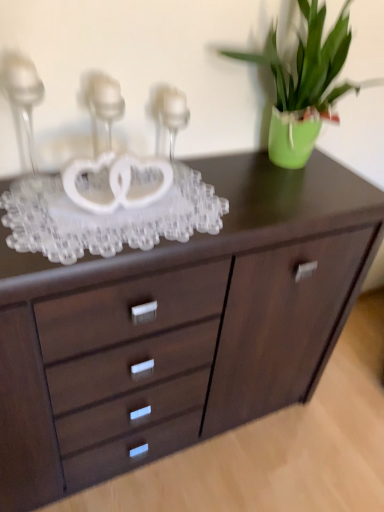
Identify the location of clear glass candle holder at upper left, the 2th candle holder positioned from the left. The width and height of the screenshot is (384, 512). (103, 109).

Locate an element on the screen. Image resolution: width=384 pixels, height=512 pixels. clear glass candle holder at upper left, positioned as the third candle holder in right-to-left order is located at coordinates (22, 102).

What do you see at coordinates (173, 114) in the screenshot? The image size is (384, 512). I see `clear glass candle holder at center, placed as the first candle holder when sorted from right to left` at bounding box center [173, 114].

Locate an element on the screen. clear glass candle holder at center, placed as the 3th candle holder when sorted from left to right is located at coordinates (173, 114).

Locate an element on the screen. clear glass candle holder at upper left, acting as the 2th candle holder starting from the right is located at coordinates (103, 109).

From the picture: Between clear glass candle holder at upper left, acting as the 2th candle holder starting from the right, and green matte vase at upper right, which one has less height?

Standing shorter between the two is clear glass candle holder at upper left, acting as the 2th candle holder starting from the right.

Who is smaller, clear glass candle holder at upper left, the 2th candle holder positioned from the left, or green matte vase at upper right?

With smaller size is clear glass candle holder at upper left, the 2th candle holder positioned from the left.

Between point (120, 95) and point (290, 7), which one is positioned in front?

The point (120, 95) is closer to the camera.

Where is `houseplant on the right of the clear glass candle holder at center, placed as the first candle holder when sorted from right to left`? houseplant on the right of the clear glass candle holder at center, placed as the first candle holder when sorted from right to left is located at coordinates [x=302, y=83].

Does point (281, 134) appear closer or farther from the camera than point (188, 118)?

Point (281, 134).

Between green matte vase at upper right and clear glass candle holder at center, placed as the first candle holder when sorted from right to left, which one appears on the left side from the viewer's perspective?

clear glass candle holder at center, placed as the first candle holder when sorted from right to left, is more to the left.

Is green matte vase at upper right far away from clear glass candle holder at center, placed as the 3th candle holder when sorted from left to right?

They are positioned close to each other.

Are clear glass candle holder at upper left, acting as the first candle holder starting from the left, and clear glass candle holder at center, placed as the 3th candle holder when sorted from left to right, far apart?

No.

Based on the photo, considering the sizes of clear glass candle holder at upper left, acting as the first candle holder starting from the left, and clear glass candle holder at center, placed as the first candle holder when sorted from right to left, in the image, is clear glass candle holder at upper left, acting as the first candle holder starting from the left, taller or shorter than clear glass candle holder at center, placed as the first candle holder when sorted from right to left,?

clear glass candle holder at upper left, acting as the first candle holder starting from the left, is taller than clear glass candle holder at center, placed as the first candle holder when sorted from right to left.

From a real-world perspective, between clear glass candle holder at upper left, positioned as the third candle holder in right-to-left order, and clear glass candle holder at center, placed as the 3th candle holder when sorted from left to right, who is vertically higher?

From a 3D spatial view, clear glass candle holder at upper left, positioned as the third candle holder in right-to-left order, is above.

Between clear glass candle holder at upper left, acting as the first candle holder starting from the left, and clear glass candle holder at center, placed as the first candle holder when sorted from right to left, which one has larger width?

clear glass candle holder at center, placed as the first candle holder when sorted from right to left.

Considering the relative positions of clear glass candle holder at center, placed as the 3th candle holder when sorted from left to right, and green matte vase at upper right in the image provided, is clear glass candle holder at center, placed as the 3th candle holder when sorted from left to right, to the right of green matte vase at upper right from the viewer's perspective?

In fact, clear glass candle holder at center, placed as the 3th candle holder when sorted from left to right, is to the left of green matte vase at upper right.

In the scene shown: From the image's perspective, would you say clear glass candle holder at center, placed as the 3th candle holder when sorted from left to right, is shown under green matte vase at upper right?

Indeed, from the image's perspective, clear glass candle holder at center, placed as the 3th candle holder when sorted from left to right, is shown beneath green matte vase at upper right.

From a real-world perspective, relative to green matte vase at upper right, is clear glass candle holder at center, placed as the 3th candle holder when sorted from left to right, vertically above or below?

clear glass candle holder at center, placed as the 3th candle holder when sorted from left to right, is below green matte vase at upper right.

Is clear glass candle holder at center, placed as the first candle holder when sorted from right to left, closer to camera compared to green matte vase at upper right?

No, it is behind green matte vase at upper right.

Which object is closer to the camera taking this photo, clear glass candle holder at upper left, acting as the first candle holder starting from the left, or dark wood chest of drawers at center?

Positioned in front is clear glass candle holder at upper left, acting as the first candle holder starting from the left.

Between clear glass candle holder at upper left, acting as the first candle holder starting from the left, and dark wood chest of drawers at center, which one has less height?

With less height is dark wood chest of drawers at center.

You are a GUI agent. You are given a task and a screenshot of the screen. Output one action in this format:
    pyautogui.click(x=<x>, y=<y>)
    Task: Click on the chest of drawers behind the clear glass candle holder at upper left, acting as the first candle holder starting from the left
    Image resolution: width=384 pixels, height=512 pixels.
    Given the screenshot: What is the action you would take?
    pyautogui.click(x=178, y=327)

Based on the photo, could you tell me if green matte vase at upper right is facing dark wood chest of drawers at center?

No, green matte vase at upper right is not oriented towards dark wood chest of drawers at center.

Is there a large distance between green matte vase at upper right and dark wood chest of drawers at center?

No.

From a real-world perspective, who is located lower, green matte vase at upper right or dark wood chest of drawers at center?

From a 3D spatial view, dark wood chest of drawers at center is below.

Is the position of green matte vase at upper right less distant than that of dark wood chest of drawers at center?

Yes.

Which object is closer to the camera, dark wood chest of drawers at center or clear glass candle holder at upper left, the 2th candle holder positioned from the left?

Positioned in front is clear glass candle holder at upper left, the 2th candle holder positioned from the left.

Which is more to the left, dark wood chest of drawers at center or clear glass candle holder at upper left, the 2th candle holder positioned from the left?

From the viewer's perspective, clear glass candle holder at upper left, the 2th candle holder positioned from the left, appears more on the left side.

From the image's perspective, which is below, dark wood chest of drawers at center or clear glass candle holder at upper left, the 2th candle holder positioned from the left?

dark wood chest of drawers at center.

From a real-world perspective, does dark wood chest of drawers at center stand above clear glass candle holder at upper left, acting as the 2th candle holder starting from the right?

Incorrect, from a real-world perspective, dark wood chest of drawers at center is lower than clear glass candle holder at upper left, acting as the 2th candle holder starting from the right.

From the green matte vase at upper right, count the 2nd candle holder to the left and point to it. Please provide its 2D coordinates.

[(103, 109)]

Identify the location of houseplant above the clear glass candle holder at center, placed as the 3th candle holder when sorted from left to right (from the image's perspective). (302, 83).

Which object lies nearer to the anchor point dark wood chest of drawers at center, clear glass candle holder at center, placed as the 3th candle holder when sorted from left to right, or green matte vase at upper right?

green matte vase at upper right lies closer to dark wood chest of drawers at center than the other object.

Considering their positions, is clear glass candle holder at center, placed as the 3th candle holder when sorted from left to right, positioned further to clear glass candle holder at upper left, acting as the first candle holder starting from the left, than clear glass candle holder at upper left, acting as the 2th candle holder starting from the right?

clear glass candle holder at center, placed as the 3th candle holder when sorted from left to right, is positioned further to the anchor clear glass candle holder at upper left, acting as the first candle holder starting from the left.

Looking at the image, which one is located closer to green matte vase at upper right, clear glass candle holder at upper left, positioned as the third candle holder in right-to-left order, or clear glass candle holder at center, placed as the 3th candle holder when sorted from left to right?

The object closer to green matte vase at upper right is clear glass candle holder at center, placed as the 3th candle holder when sorted from left to right.

From the image, which object appears to be farther from green matte vase at upper right, dark wood chest of drawers at center or clear glass candle holder at center, placed as the first candle holder when sorted from right to left?

Based on the image, dark wood chest of drawers at center appears to be further to green matte vase at upper right.

Consider the image. Considering their positions, is clear glass candle holder at upper left, the 2th candle holder positioned from the left, positioned closer to green matte vase at upper right than dark wood chest of drawers at center?

Among the two, clear glass candle holder at upper left, the 2th candle holder positioned from the left, is located nearer to green matte vase at upper right.

Looking at this image, based on their spatial positions, is dark wood chest of drawers at center or clear glass candle holder at center, placed as the 3th candle holder when sorted from left to right, further from clear glass candle holder at upper left, the 2th candle holder positioned from the left?

Based on the image, dark wood chest of drawers at center appears to be further to clear glass candle holder at upper left, the 2th candle holder positioned from the left.

From the image, which object appears to be nearer to dark wood chest of drawers at center, clear glass candle holder at upper left, positioned as the third candle holder in right-to-left order, or clear glass candle holder at upper left, acting as the 2th candle holder starting from the right?

clear glass candle holder at upper left, acting as the 2th candle holder starting from the right, is closer to dark wood chest of drawers at center.

Looking at the image, which one is located closer to clear glass candle holder at upper left, acting as the first candle holder starting from the left, dark wood chest of drawers at center or clear glass candle holder at upper left, the 2th candle holder positioned from the left?

The object closer to clear glass candle holder at upper left, acting as the first candle holder starting from the left, is clear glass candle holder at upper left, the 2th candle holder positioned from the left.

Identify the location of candle holder located between clear glass candle holder at upper left, the 2th candle holder positioned from the left, and green matte vase at upper right in the left-right direction. (173, 114).

Locate an element on the screen. Image resolution: width=384 pixels, height=512 pixels. candle holder that lies between clear glass candle holder at upper left, the 2th candle holder positioned from the left, and dark wood chest of drawers at center from top to bottom is located at coordinates (22, 102).

Locate an element on the screen. This screenshot has width=384, height=512. candle holder located between clear glass candle holder at upper left, positioned as the third candle holder in right-to-left order, and clear glass candle holder at center, placed as the first candle holder when sorted from right to left, in the left-right direction is located at coordinates (103, 109).